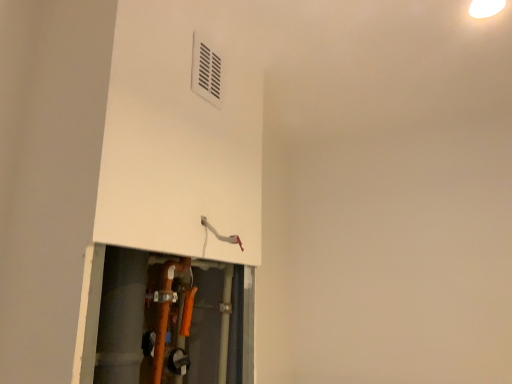
In order to face white plastic air conditioning at upper center, should I rotate leftwards or rightwards?

→ It's best to rotate left around 5.759 degrees.

The height and width of the screenshot is (384, 512). Describe the element at coordinates (206, 71) in the screenshot. I see `white plastic air conditioning at upper center` at that location.

In order to click on white plastic air conditioning at upper center in this screenshot , I will do `click(206, 71)`.

The width and height of the screenshot is (512, 384). I want to click on white plastic air conditioning at upper center, so click(206, 71).